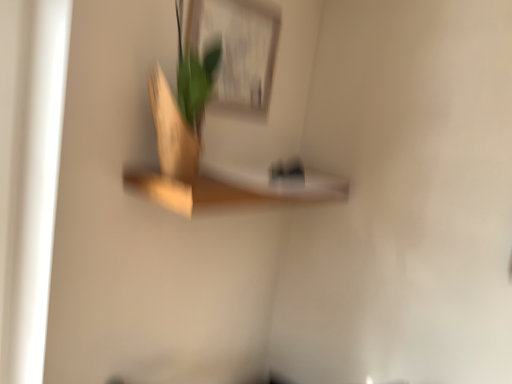
What do you see at coordinates (231, 189) in the screenshot?
I see `wooden shelf at center` at bounding box center [231, 189].

Find the location of a particular element. This screenshot has width=512, height=384. wooden shelf at center is located at coordinates (231, 189).

Locate an element on the screen. Image resolution: width=512 pixels, height=384 pixels. matte white picture frame at upper center is located at coordinates (234, 49).

What do you see at coordinates (234, 49) in the screenshot? I see `matte white picture frame at upper center` at bounding box center [234, 49].

In order to face matte white picture frame at upper center, should I rotate leftwards or rightwards?

It's best to rotate left around 2.243 degrees.

I want to click on wooden shelf at center, so click(x=231, y=189).

Between matte white picture frame at upper center and wooden shelf at center, which one appears on the left side from the viewer's perspective?

From the viewer's perspective, matte white picture frame at upper center appears more on the left side.

Does matte white picture frame at upper center lie behind wooden shelf at center?

Yes.

Considering the points (193, 29) and (209, 182), which point is behind, point (193, 29) or point (209, 182)?

Positioned behind is point (209, 182).

From the image's perspective, between matte white picture frame at upper center and wooden shelf at center, which one is located above?

matte white picture frame at upper center appears higher in the image.

From a real-world perspective, who is located lower, matte white picture frame at upper center or wooden shelf at center?

wooden shelf at center.

Between matte white picture frame at upper center and wooden shelf at center, which one has larger width?

Wider between the two is wooden shelf at center.

Who is shorter, matte white picture frame at upper center or wooden shelf at center?

wooden shelf at center is shorter.

Who is bigger, matte white picture frame at upper center or wooden shelf at center?

Bigger between the two is wooden shelf at center.

Which is correct: matte white picture frame at upper center is inside wooden shelf at center, or outside of it?

matte white picture frame at upper center is outside wooden shelf at center.

Would you say matte white picture frame at upper center is a long distance from wooden shelf at center?

No, matte white picture frame at upper center is in close proximity to wooden shelf at center.

Is matte white picture frame at upper center looking in the opposite direction of wooden shelf at center?

matte white picture frame at upper center does not have its back to wooden shelf at center.

The image size is (512, 384). Identify the location of picture frame above the wooden shelf at center (from the image's perspective). (234, 49).

Considering the positions of objects wooden shelf at center and matte white picture frame at upper center in the image provided, who is more to the right, wooden shelf at center or matte white picture frame at upper center?

wooden shelf at center is more to the right.

Consider the image. Which is behind, wooden shelf at center or matte white picture frame at upper center?

matte white picture frame at upper center is further away from the camera.

Considering the points (258, 174) and (252, 86), which point is in front, point (258, 174) or point (252, 86)?

The point (252, 86) is closer to the camera.

From the image's perspective, is wooden shelf at center above or below matte white picture frame at upper center?

From the image's perspective, wooden shelf at center appears below matte white picture frame at upper center.

From a real-world perspective, relative to matte white picture frame at upper center, is wooden shelf at center vertically above or below?

From a real-world perspective, wooden shelf at center is physically below matte white picture frame at upper center.

In terms of width, does wooden shelf at center look wider or thinner when compared to matte white picture frame at upper center?

wooden shelf at center is wider than matte white picture frame at upper center.

Who is shorter, wooden shelf at center or matte white picture frame at upper center?

With less height is wooden shelf at center.

Is wooden shelf at center smaller than matte white picture frame at upper center?

No, wooden shelf at center is not smaller than matte white picture frame at upper center.

Do you think wooden shelf at center is within matte white picture frame at upper center, or outside of it?

wooden shelf at center is located beyond the bounds of matte white picture frame at upper center.

Are wooden shelf at center and matte white picture frame at upper center beside each other?

No, wooden shelf at center is not making contact with matte white picture frame at upper center.

Does wooden shelf at center turn towards matte white picture frame at upper center?

No, wooden shelf at center is not facing towards matte white picture frame at upper center.

Looking at this image, how many degrees apart are the facing directions of wooden shelf at center and matte white picture frame at upper center?

There is a 0.148-degree angle between the facing directions of wooden shelf at center and matte white picture frame at upper center.

Where is `shelf located below the matte white picture frame at upper center (from the image's perspective)`? The height and width of the screenshot is (384, 512). shelf located below the matte white picture frame at upper center (from the image's perspective) is located at coordinates (231, 189).

Identify the location of picture frame lying above the wooden shelf at center (from the image's perspective). The height and width of the screenshot is (384, 512). (234, 49).

Where is `shelf located on the right of matte white picture frame at upper center`? The image size is (512, 384). shelf located on the right of matte white picture frame at upper center is located at coordinates (231, 189).